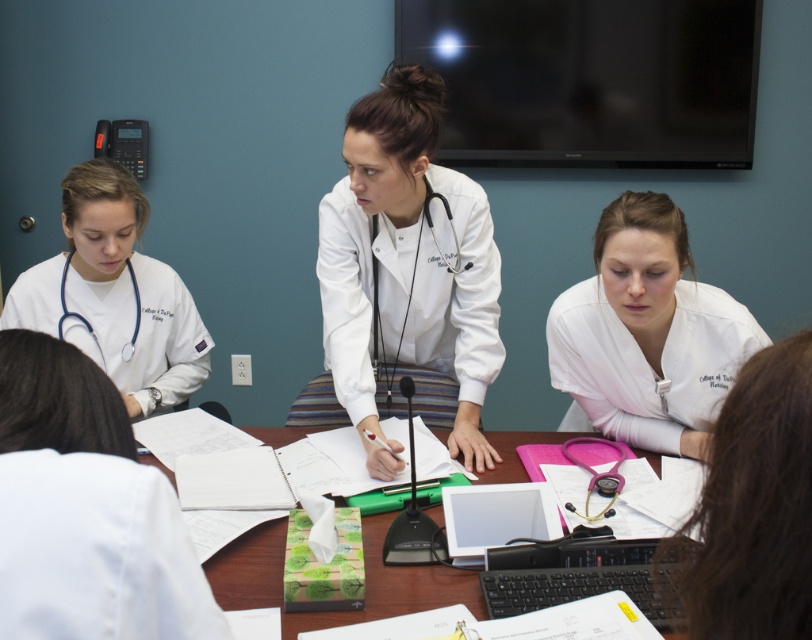
You are organizing a medical conference and need to place a matte black stethoscope at lower left on the wooden table at center. Will the stethoscope fit on the table?

The wooden table at center is larger in size compared to the matte black stethoscope at lower left, so the stethoscope will fit on the table.